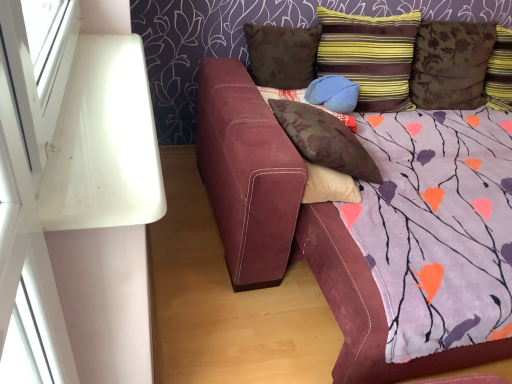
Question: Does striped velvet pillow at upper right, placed as the 2th pillow when sorted from right to left, have a lesser width compared to brown suede pillow at center, which ranks as the second pillow in left-to-right order?

Choices:
 (A) yes
 (B) no

Answer: (A)

Question: Is striped velvet pillow at upper right, marked as the 4th pillow in a left-to-right arrangement, positioned beyond the bounds of brown suede pillow at center, which ranks as the second pillow in left-to-right order?

Choices:
 (A) yes
 (B) no

Answer: (A)

Question: Would you say brown suede pillow at center, acting as the fourth pillow starting from the right, is part of striped velvet pillow at upper right, placed as the 2th pillow when sorted from right to left,'s contents?

Choices:
 (A) no
 (B) yes

Answer: (A)

Question: Does striped velvet pillow at upper right, marked as the 4th pillow in a left-to-right arrangement, have a larger size compared to brown suede pillow at center, which ranks as the second pillow in left-to-right order?

Choices:
 (A) no
 (B) yes

Answer: (B)

Question: Can you confirm if striped velvet pillow at upper right, placed as the 2th pillow when sorted from right to left, is smaller than brown suede pillow at center, which ranks as the second pillow in left-to-right order?

Choices:
 (A) no
 (B) yes

Answer: (A)

Question: Based on their sizes in the image, would you say suede couch at center is bigger or smaller than striped velvet pillow at upper right, marked as the 4th pillow in a left-to-right arrangement?

Choices:
 (A) small
 (B) big

Answer: (B)

Question: In terms of width, does suede couch at center look wider or thinner when compared to striped velvet pillow at upper right, marked as the 4th pillow in a left-to-right arrangement?

Choices:
 (A) thin
 (B) wide

Answer: (B)

Question: Is suede couch at center inside or outside of striped velvet pillow at upper right, placed as the 2th pillow when sorted from right to left?

Choices:
 (A) inside
 (B) outside

Answer: (B)

Question: Is suede couch at center in front of or behind striped velvet pillow at upper right, placed as the 2th pillow when sorted from right to left, in the image?

Choices:
 (A) behind
 (B) front

Answer: (B)

Question: From a real-world perspective, relative to suede couch at center, is brown suede pillow at center, which ranks as the second pillow in left-to-right order, vertically above or below?

Choices:
 (A) below
 (B) above

Answer: (B)

Question: Is point (320, 119) positioned closer to the camera than point (260, 274)?

Choices:
 (A) farther
 (B) closer

Answer: (B)

Question: Is brown suede pillow at center, acting as the fourth pillow starting from the right, taller or shorter than suede couch at center?

Choices:
 (A) tall
 (B) short

Answer: (A)

Question: In terms of width, does brown suede pillow at center, which ranks as the second pillow in left-to-right order, look wider or thinner when compared to suede couch at center?

Choices:
 (A) thin
 (B) wide

Answer: (A)

Question: Looking at their shapes, would you say brown suede pillow at upper center, the 5th pillow viewed from the right, is wider or thinner than striped velvet pillow at upper right, marked as the 4th pillow in a left-to-right arrangement?

Choices:
 (A) thin
 (B) wide

Answer: (A)

Question: Considering their positions, is brown suede pillow at upper center, the 1th pillow viewed from the left, located in front of or behind striped velvet pillow at upper right, marked as the 4th pillow in a left-to-right arrangement?

Choices:
 (A) front
 (B) behind

Answer: (B)